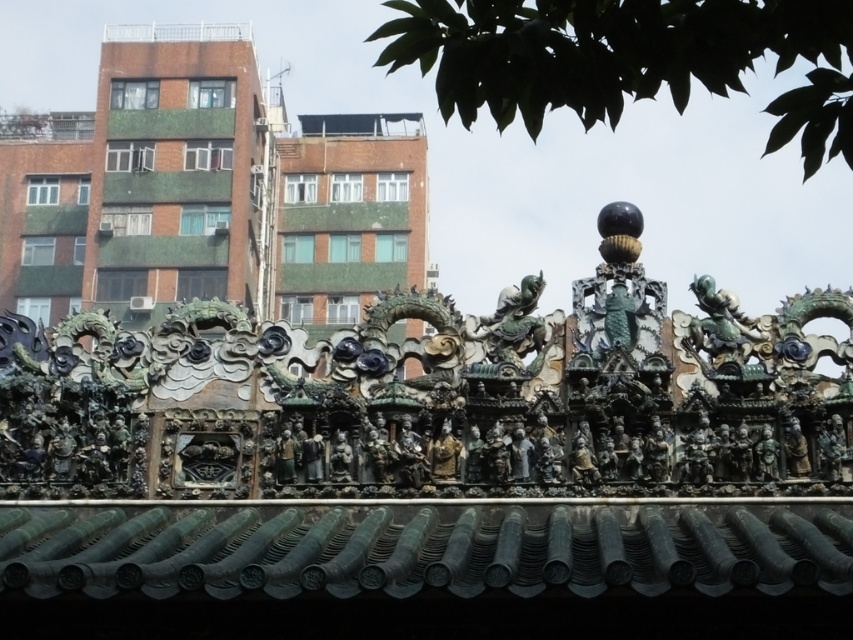
Question: Which object appears closest to the camera in this image?

Choices:
 (A) green patinated metal figure at upper right
 (B) bronze statue at center
 (C) green glazed tiles at upper center

Answer: (B)

Question: Which point appears farthest from the camera in this image?

Choices:
 (A) (149, 44)
 (B) (433, 468)

Answer: (A)

Question: Does green patinated metal dragon at center appear over bronze statue at center?

Choices:
 (A) no
 (B) yes

Answer: (B)

Question: Which of the following is the farthest from the observer?

Choices:
 (A) green patinated metal figure at upper right
 (B) bronze statue at center
 (C) green glazed tiles at upper center

Answer: (C)

Question: Is green glazed tiles at upper center above bronze statue at center?

Choices:
 (A) no
 (B) yes

Answer: (B)

Question: Does green patinated metal dragon at center come in front of green patinated metal figure at upper right?

Choices:
 (A) no
 (B) yes

Answer: (A)